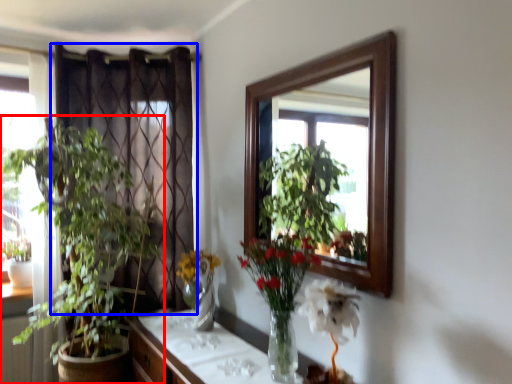
Question: Which of the following is the closest to the observer, houseplant (highlighted by a red box) or curtain (highlighted by a blue box)?

Choices:
 (A) houseplant
 (B) curtain

Answer: (A)